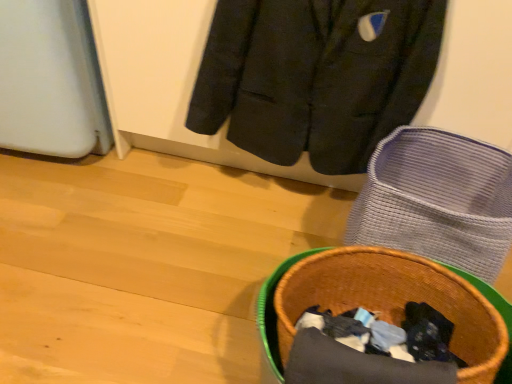
This screenshot has height=384, width=512. What do you see at coordinates (314, 77) in the screenshot?
I see `dark gray wool jacket at upper center` at bounding box center [314, 77].

In order to face woven fabric basket at lower right, should I rotate leftwards or rightwards?

To align with it, rotate right about 22.261°.

At what (x,y) coordinates should I click in order to perform the action: click on dark gray wool jacket at upper center. Please return your answer as a coordinate pair (x, y). This screenshot has height=384, width=512. Looking at the image, I should click on (314, 77).

Looking at this image, between dark gray wool jacket at upper center and woven fabric basket at lower right, which one has less height?

woven fabric basket at lower right.

Is dark gray wool jacket at upper center bigger than woven fabric basket at lower right?

No, dark gray wool jacket at upper center is not bigger than woven fabric basket at lower right.

Does dark gray wool jacket at upper center have a greater width compared to woven fabric basket at lower right?

Incorrect, the width of dark gray wool jacket at upper center does not surpass that of woven fabric basket at lower right.

From the image's perspective, is dark gray wool jacket at upper center located above or below woven fabric basket at lower right?

Clearly, from the image's perspective, dark gray wool jacket at upper center is above woven fabric basket at lower right.

Would you say brown woven basket at lower right is inside or outside woven fabric basket at lower right?

brown woven basket at lower right exists outside the volume of woven fabric basket at lower right.

From a real-world perspective, which object stands above the other?

In real-world perspective, brown woven basket at lower right is above.

Is brown woven basket at lower right to the left of woven fabric basket at lower right from the viewer's perspective?

Indeed, brown woven basket at lower right is positioned on the left side of woven fabric basket at lower right.

Considering the positions of points (255, 138) and (289, 258), is point (255, 138) closer to camera compared to point (289, 258)?

No, it is not.

Which object is more forward, dark gray wool jacket at upper center or brown woven basket at lower right?

brown woven basket at lower right is more forward.

Can you tell me how much dark gray wool jacket at upper center and brown woven basket at lower right differ in facing direction?

There is a 8.28-degree angle between the facing directions of dark gray wool jacket at upper center and brown woven basket at lower right.

From a real-world perspective, between dark gray wool jacket at upper center and brown woven basket at lower right, who is vertically lower?

From a 3D spatial view, brown woven basket at lower right is below.

Based on the photo, from the image's perspective, would you say woven fabric basket at lower right is shown under dark gray wool jacket at upper center?

Yes.

Which of these two, woven fabric basket at lower right or dark gray wool jacket at upper center, stands taller?

dark gray wool jacket at upper center.

Which object is further away from the camera taking this photo, woven fabric basket at lower right or dark gray wool jacket at upper center?

dark gray wool jacket at upper center is further away from the camera.

From a real-world perspective, is woven fabric basket at lower right over dark gray wool jacket at upper center?

No, from a real-world perspective, woven fabric basket at lower right is not above dark gray wool jacket at upper center.

Considering the relative sizes of woven fabric basket at lower right and brown woven basket at lower right in the image provided, is woven fabric basket at lower right shorter than brown woven basket at lower right?

No.

Is woven fabric basket at lower right inside or outside of brown woven basket at lower right?

woven fabric basket at lower right is located beyond the bounds of brown woven basket at lower right.

This screenshot has width=512, height=384. I want to click on basket container that is in front of the woven fabric basket at lower right, so click(274, 311).

Is brown woven basket at lower right next to dark gray wool jacket at upper center and touching it?

brown woven basket at lower right and dark gray wool jacket at upper center are clearly separated.

Is brown woven basket at lower right in front of or behind dark gray wool jacket at upper center in the image?

Visually, brown woven basket at lower right is located in front of dark gray wool jacket at upper center.

Is brown woven basket at lower right oriented away from dark gray wool jacket at upper center?

Absolutely, brown woven basket at lower right is directed away from dark gray wool jacket at upper center.

Considering the relative sizes of brown woven basket at lower right and dark gray wool jacket at upper center in the image provided, is brown woven basket at lower right bigger than dark gray wool jacket at upper center?

Yes, brown woven basket at lower right is bigger than dark gray wool jacket at upper center.

Identify the location of footwear beneath the dark gray wool jacket at upper center (from a real-world perspective). This screenshot has height=384, width=512. (437, 200).

The height and width of the screenshot is (384, 512). What are the coordinates of `basket container that is above the woven fabric basket at lower right (from a real-world perspective)` in the screenshot? It's located at (274, 311).

Considering their positions, is brown woven basket at lower right positioned further to woven fabric basket at lower right than dark gray wool jacket at upper center?

brown woven basket at lower right lies further to woven fabric basket at lower right than the other object.

From the image, which object appears to be farther from woven fabric basket at lower right, dark gray wool jacket at upper center or brown woven basket at lower right?

brown woven basket at lower right is positioned further to the anchor woven fabric basket at lower right.

Which object lies further to the anchor point brown woven basket at lower right, woven fabric basket at lower right or dark gray wool jacket at upper center?

dark gray wool jacket at upper center is positioned further to the anchor brown woven basket at lower right.

When comparing their distances from brown woven basket at lower right, does dark gray wool jacket at upper center or woven fabric basket at lower right seem closer?

woven fabric basket at lower right is positioned closer to the anchor brown woven basket at lower right.

Estimate the real-world distances between objects in this image. Which object is further from dark gray wool jacket at upper center, woven fabric basket at lower right or brown woven basket at lower right?

brown woven basket at lower right.

Estimate the real-world distances between objects in this image. Which object is closer to dark gray wool jacket at upper center, brown woven basket at lower right or woven fabric basket at lower right?

woven fabric basket at lower right.

You are a GUI agent. You are given a task and a screenshot of the screen. Output one action in this format:
    pyautogui.click(x=<x>, y=<y>)
    Task: Click on the footwear between dark gray wool jacket at upper center and brown woven basket at lower right from top to bottom
    The image size is (512, 384).
    Given the screenshot: What is the action you would take?
    pyautogui.click(x=437, y=200)